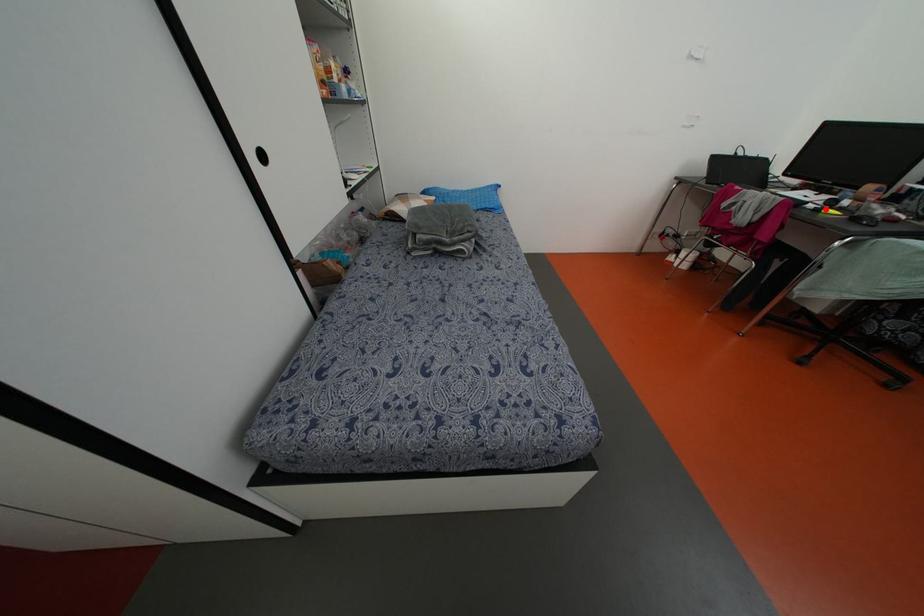
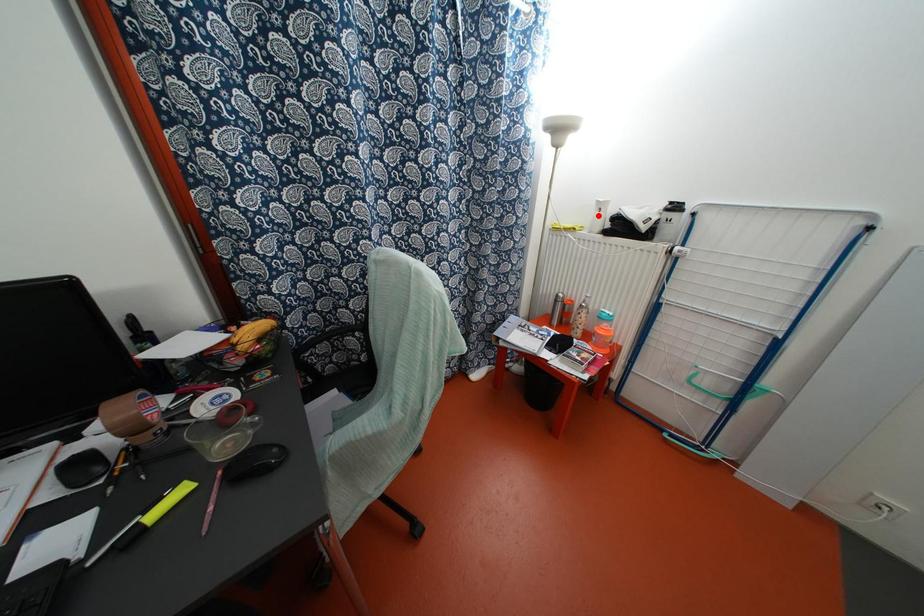
I am providing you with two images of the same scene from different viewpoints. A red point is marked on the first image and another point is marked on the second image. Is the marked point in image1 the same physical position as the marked point in image2?

No